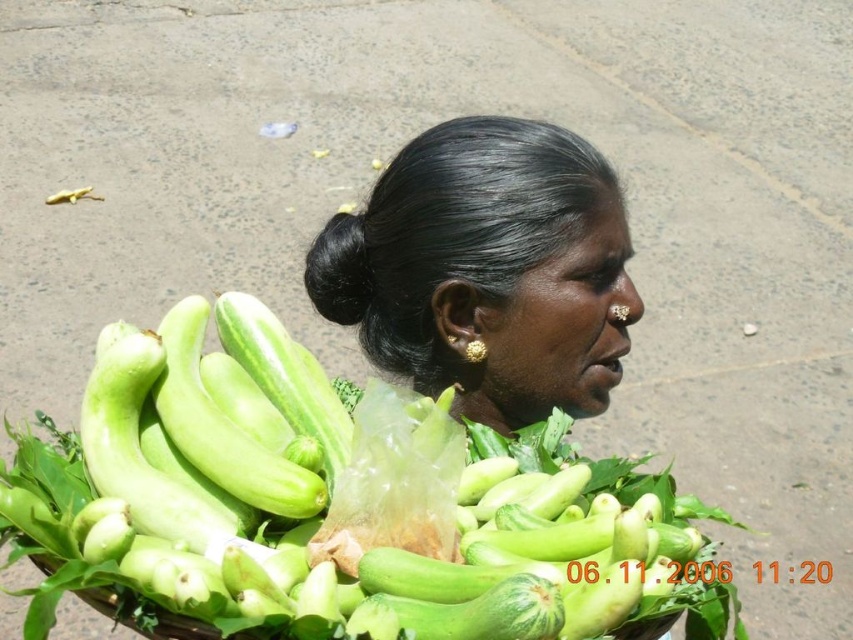
Which is more to the right, green smooth zucchini at center or black shiny hair at center?

Positioned to the right is black shiny hair at center.

Is point (74, 454) closer to camera compared to point (338, 243)?

Yes, it is.

Who is more forward, [287,376] or [558,392]?

Point [287,376]

Where is `green smooth zucchini at center`? green smooth zucchini at center is located at coordinates 305,500.